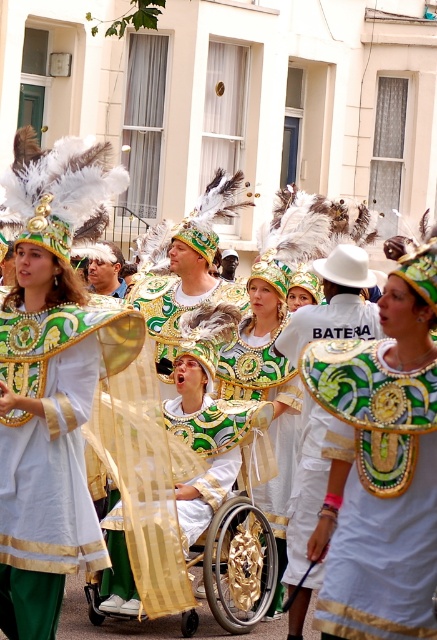
Question: Does matte gold and green costume at center appear on the left side of metallic gold helmet at center?

Choices:
 (A) no
 (B) yes

Answer: (B)

Question: Is matte green fabric cape at center behind gold metallic wheelchair at center?

Choices:
 (A) yes
 (B) no

Answer: (B)

Question: Does matte green fabric cape at center appear on the right side of matte gold and green costume at center?

Choices:
 (A) yes
 (B) no

Answer: (A)

Question: Which point is closer to the camera?

Choices:
 (A) (27, 324)
 (B) (217, 582)
 (C) (290, 436)
 (D) (371, 621)

Answer: (D)

Question: Which of the following is the farthest from the observer?

Choices:
 (A) (256, 371)
 (B) (318, 547)
 (C) (37, 548)
 (D) (231, 564)

Answer: (A)

Question: Which point is farther to the camera?

Choices:
 (A) (228, 609)
 (B) (351, 429)
 (C) (264, 380)

Answer: (C)